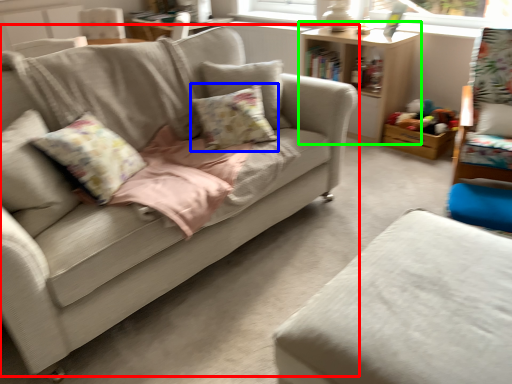
Question: Considering the real-world distances, which object is farthest from studio couch (highlighted by a red box)? pillow (highlighted by a blue box) or table (highlighted by a green box)?

Choices:
 (A) pillow
 (B) table

Answer: (B)